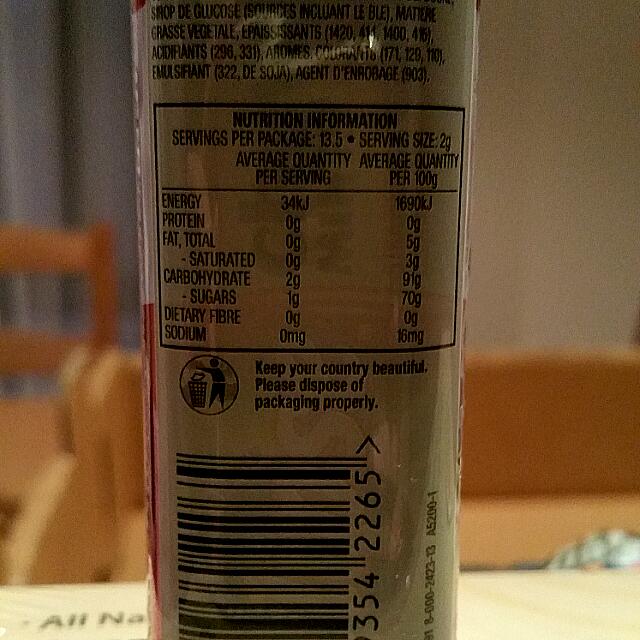
Where is `table`? This screenshot has height=640, width=640. table is located at coordinates (532, 617).